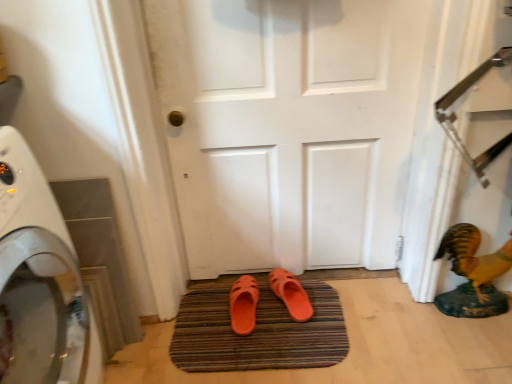
Image resolution: width=512 pixels, height=384 pixels. I want to click on vacant region under orange rubber bath mat at center (from a real-world perspective), so click(x=251, y=342).